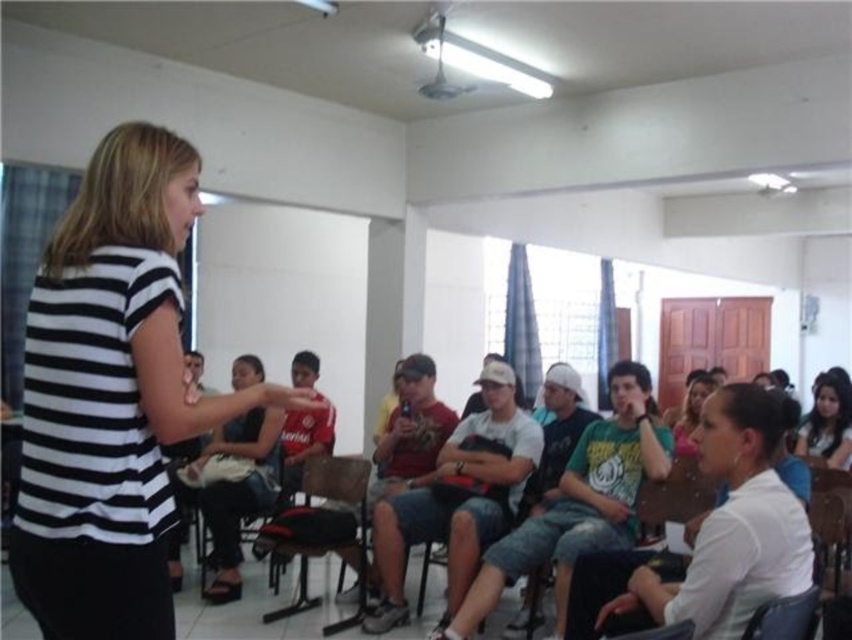
You are sitting in the wooden chair at center and want to move to the black leather chair at lower right. Which direction should you move to reach it?

The wooden chair at center is located below the black leather chair at lower right, so you should move upward to reach it.

You are a person who needs to choose between sitting on the wooden chair at center or the black leather chair at lower right. Which one would you choose if you prefer a more spacious seat?

The wooden chair at center has a larger size compared to the black leather chair at lower right, so you should choose the wooden chair at center for a more spacious seat.

From the picture: You are a person trying to sit in the classroom. You see a wooden chair at center and a black fabric chair at center. Which chair is closer to you?

The wooden chair at center is closer to you because it is positioned over the black fabric chair at center.